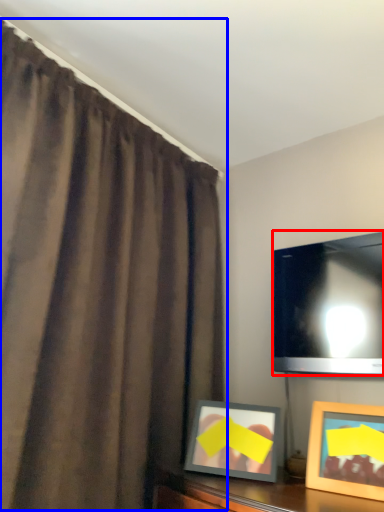
Question: Which point is further to the camera, television (highlighted by a red box) or curtain (highlighted by a blue box)?

Choices:
 (A) television
 (B) curtain

Answer: (A)